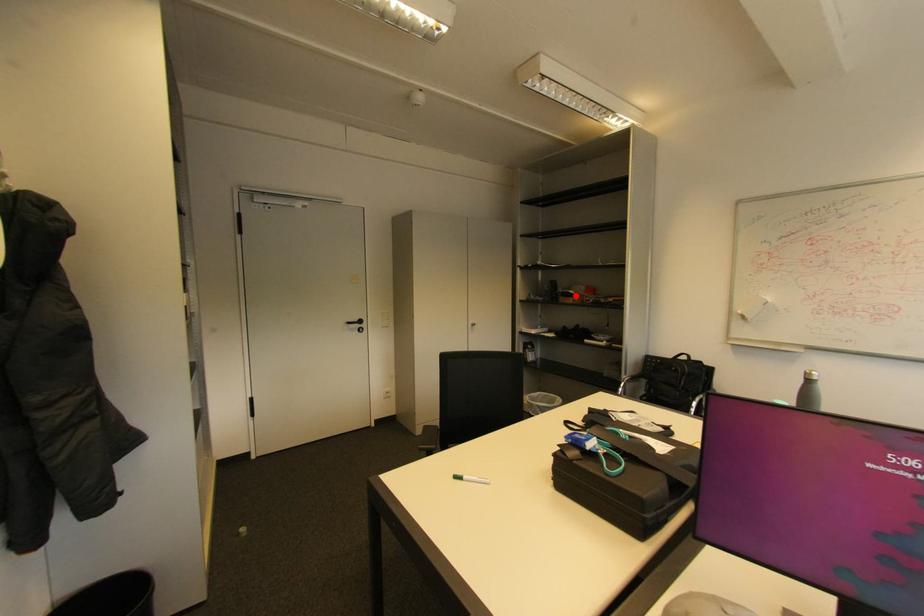
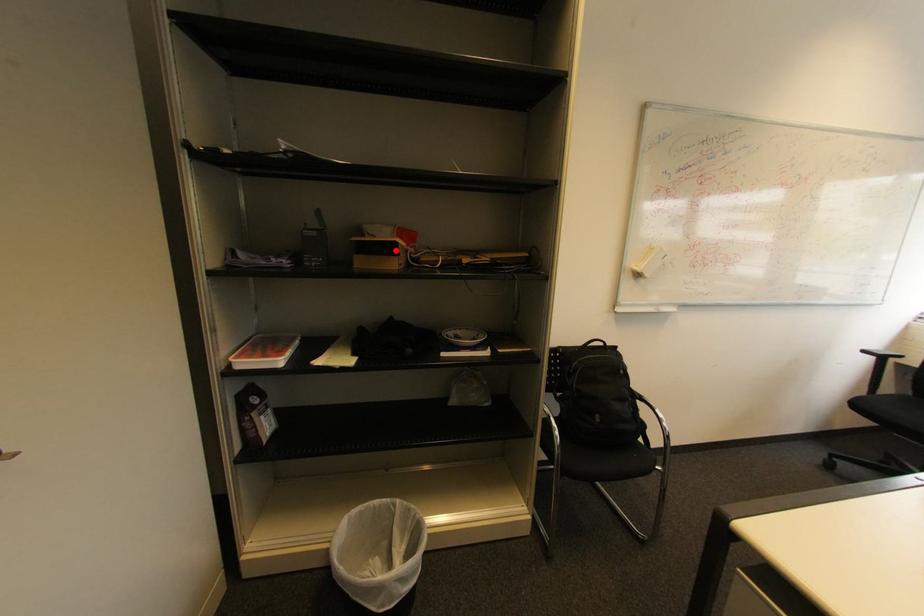
I am providing you with two images of the same scene from different viewpoints. A red point is marked on the first image and another point is marked on the second image. Do the highlighted points in image1 and image2 indicate the same real-world spot?

Yes